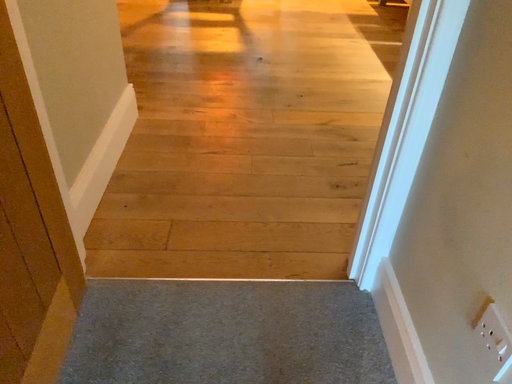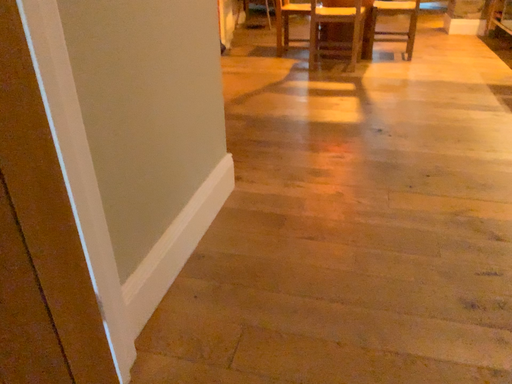
Question: Which way did the camera rotate in the video?

Choices:
 (A) rotated upward
 (B) rotated downward

Answer: (A)